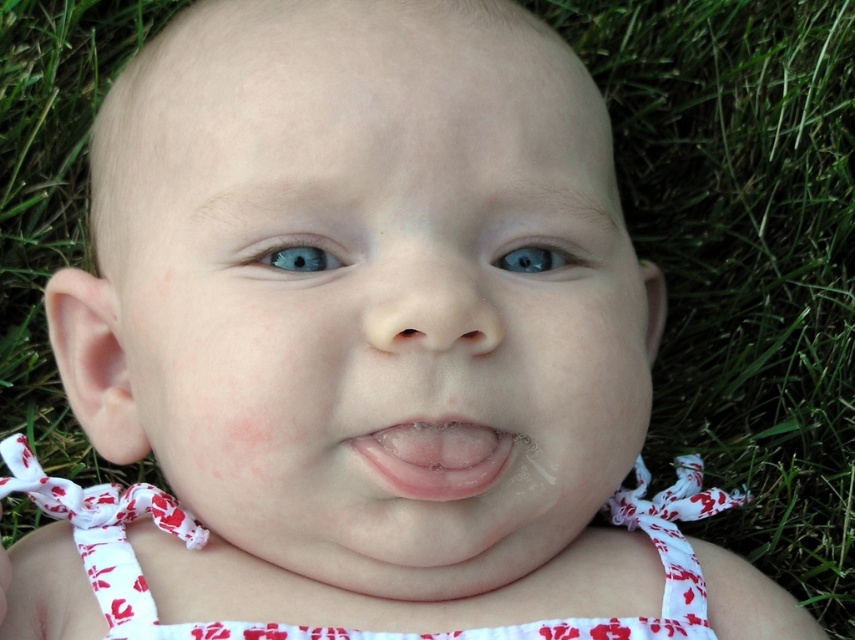
Question: Can you confirm if blue glossy eye at upper center is wider than blue smooth eye at center?

Choices:
 (A) no
 (B) yes

Answer: (B)

Question: Is white floral fabric dress at center closer to camera compared to pink smooth tongue at center?

Choices:
 (A) no
 (B) yes

Answer: (A)

Question: Based on their relative distances, which object is nearer to the smooth flesh nose at center?

Choices:
 (A) blue smooth eye at center
 (B) blue glossy eye at upper center
 (C) smooth skin baby at center
 (D) white floral fabric dress at center

Answer: (B)

Question: Observing the image, what is the correct spatial positioning of smooth skin baby at center in reference to smooth flesh nose at center?

Choices:
 (A) above
 (B) below

Answer: (A)

Question: Which point is closer to the camera?

Choices:
 (A) pink smooth tongue at center
 (B) white floral fabric dress at center
 (C) smooth skin baby at center
 (D) blue glossy eye at upper center

Answer: (C)

Question: Which of the following is the farthest from the observer?

Choices:
 (A) (181, 637)
 (B) (516, 264)
 (C) (293, 240)
 (D) (351, 236)

Answer: (B)